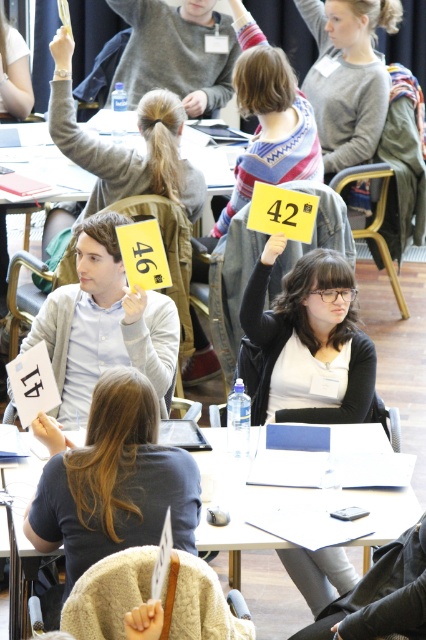
Question: Can you confirm if matte black card at center is bigger than white paper at center?

Choices:
 (A) yes
 (B) no

Answer: (B)

Question: Which object is closer to the camera taking this photo?

Choices:
 (A) light gray sweater at upper center
 (B) white paper at center

Answer: (B)

Question: Among these objects, which one is farthest from the camera?

Choices:
 (A) white paper at center
 (B) matte white card at center
 (C) matte black card at center

Answer: (C)

Question: Does dark gray sweater at center lie behind matte gray sweater at upper center?

Choices:
 (A) no
 (B) yes

Answer: (A)

Question: Which object is the closest to the matte white card at center?

Choices:
 (A) matte black card at center
 (B) matte gray sweater at upper center

Answer: (A)

Question: Is matte black card at center in front of dark gray sweater at center?

Choices:
 (A) no
 (B) yes

Answer: (A)